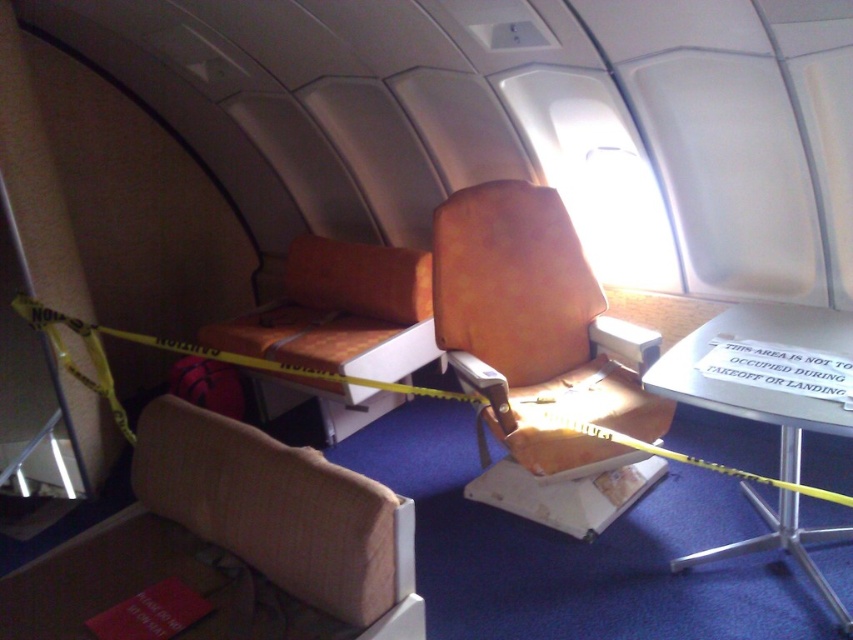
You are a flight attendant checking the placement of the caution tape in the aircraft cabin. The caution tape is anchored at both ends to two points in the scene. Based on your vantage point, which of the two points, point (x=546, y=337) or point (x=329, y=360), is closer to you?

Point (x=546, y=337) is closer to the camera than point (x=329, y=360), so the point (x=546, y=337) is closer to you.